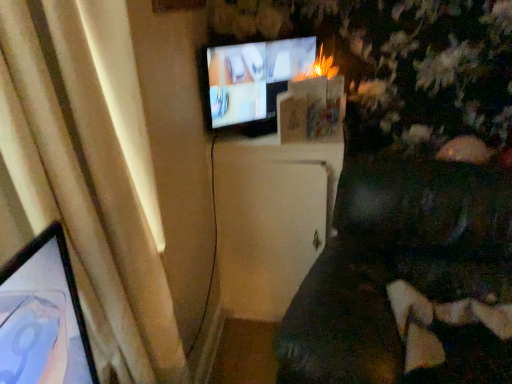
Measure the distance between white matte cabinet at center and camera.

white matte cabinet at center and camera are 1.70 meters apart.

What do you see at coordinates (88, 187) in the screenshot?
I see `beige fabric curtain at left` at bounding box center [88, 187].

Where is `dark brown fabric couch at lower right`? The width and height of the screenshot is (512, 384). dark brown fabric couch at lower right is located at coordinates (403, 274).

Looking at this image, is dark brown fabric couch at lower right not within beige fabric curtain at left?

Absolutely, dark brown fabric couch at lower right is external to beige fabric curtain at left.

Is the position of dark brown fabric couch at lower right more distant than that of beige fabric curtain at left?

No, it is in front of beige fabric curtain at left.

How different are the orientations of dark brown fabric couch at lower right and beige fabric curtain at left in degrees?

The facing directions of dark brown fabric couch at lower right and beige fabric curtain at left are 53.3 degrees apart.

From the picture: From the image's perspective, is matte black tv at upper center under white matte cabinet at center?

No, from the image's perspective, matte black tv at upper center is not beneath white matte cabinet at center.

Is matte black tv at upper center oriented away from white matte cabinet at center?

No, matte black tv at upper center is not facing the opposite direction of white matte cabinet at center.

Which is more to the right, matte black tv at upper center or white matte cabinet at center?

Positioned to the right is white matte cabinet at center.

From the image's perspective, is matte black tv at upper center located beneath beige fabric curtain at left?

Actually, matte black tv at upper center appears above beige fabric curtain at left in the image.

Would you consider matte black tv at upper center to be distant from beige fabric curtain at left?

matte black tv at upper center is actually quite close to beige fabric curtain at left.

Is beige fabric curtain at left surrounded by matte black tv at upper center?

No, beige fabric curtain at left is not a part of matte black tv at upper center.

Is matte black tv at upper center looking in the opposite direction of beige fabric curtain at left?

No, matte black tv at upper center's orientation is not away from beige fabric curtain at left.

In the image, is beige fabric curtain at left positioned in front of or behind white matte cabinet at center?

beige fabric curtain at left is in front of white matte cabinet at center.

In the scene shown: Is there a large distance between beige fabric curtain at left and white matte cabinet at center?

No, there isn't a large distance between beige fabric curtain at left and white matte cabinet at center.

Where is `table behind the beige fabric curtain at left`? table behind the beige fabric curtain at left is located at coordinates (271, 219).

Which of these two, beige fabric curtain at left or white matte cabinet at center, is smaller?

With smaller size is beige fabric curtain at left.

Is dark brown fabric couch at lower right completely or partially outside of matte black tv at upper center?

Yes.

Find the location of `furniture lying in front of the matte black tv at upper center`. furniture lying in front of the matte black tv at upper center is located at coordinates (403, 274).

Is the depth of dark brown fabric couch at lower right greater than that of matte black tv at upper center?

No, it is not.

Is dark brown fabric couch at lower right facing towards matte black tv at upper center?

No, dark brown fabric couch at lower right is not facing towards matte black tv at upper center.

Which is in front, point (242, 183) or point (206, 89)?

The point (206, 89) is closer.

Would you say white matte cabinet at center is a long distance from matte black tv at upper center?

They are positioned close to each other.

Does white matte cabinet at center have a greater height compared to matte black tv at upper center?

Correct, white matte cabinet at center is much taller as matte black tv at upper center.

Is beige fabric curtain at left situated inside matte black tv at upper center or outside?

beige fabric curtain at left cannot be found inside matte black tv at upper center.

Based on their positions, is beige fabric curtain at left located to the left or right of matte black tv at upper center?

beige fabric curtain at left is positioned on matte black tv at upper center's left side.

From the image's perspective, relative to matte black tv at upper center, is beige fabric curtain at left above or below?

beige fabric curtain at left is situated lower than matte black tv at upper center in the image.

Which is behind, beige fabric curtain at left or matte black tv at upper center?

matte black tv at upper center is further from the camera.

Identify the location of furniture that is below the beige fabric curtain at left (from the image's perspective). (403, 274).

At what (x,y) coordinates should I click in order to perform the action: click on television above the white matte cabinet at center (from the image's perspective). Please return your answer as a coordinate pair (x, y). Looking at the image, I should click on (250, 82).

Considering their positions, is matte black tv at upper center positioned further to beige fabric curtain at left than white matte cabinet at center?

Among the two, matte black tv at upper center is located further to beige fabric curtain at left.

When comparing their distances from dark brown fabric couch at lower right, does beige fabric curtain at left or white matte cabinet at center seem closer?

Among the two, white matte cabinet at center is located nearer to dark brown fabric couch at lower right.

Which object lies further to the anchor point matte black tv at upper center, white matte cabinet at center or dark brown fabric couch at lower right?

dark brown fabric couch at lower right is further to matte black tv at upper center.

Considering their positions, is dark brown fabric couch at lower right positioned closer to matte black tv at upper center than white matte cabinet at center?

The object closer to matte black tv at upper center is white matte cabinet at center.

From the image, which object appears to be nearer to matte black tv at upper center, dark brown fabric couch at lower right or beige fabric curtain at left?

The object closer to matte black tv at upper center is dark brown fabric couch at lower right.

Based on their spatial positions, is matte black tv at upper center or beige fabric curtain at left further from white matte cabinet at center?

beige fabric curtain at left is positioned further to the anchor white matte cabinet at center.

Based on the photo, which object lies further to the anchor point matte black tv at upper center, beige fabric curtain at left or white matte cabinet at center?

beige fabric curtain at left is further to matte black tv at upper center.

Based on their spatial positions, is beige fabric curtain at left or dark brown fabric couch at lower right further from matte black tv at upper center?

beige fabric curtain at left is positioned further to the anchor matte black tv at upper center.

Find the location of a particular element. This screenshot has width=512, height=384. television positioned between dark brown fabric couch at lower right and white matte cabinet at center from near to far is located at coordinates (250, 82).

Image resolution: width=512 pixels, height=384 pixels. Identify the location of table situated between beige fabric curtain at left and dark brown fabric couch at lower right from left to right. (271, 219).

The width and height of the screenshot is (512, 384). Find the location of `television between beige fabric curtain at left and dark brown fabric couch at lower right`. television between beige fabric curtain at left and dark brown fabric couch at lower right is located at coordinates (250, 82).

The width and height of the screenshot is (512, 384). I want to click on television between beige fabric curtain at left and white matte cabinet at center from front to back, so click(x=250, y=82).